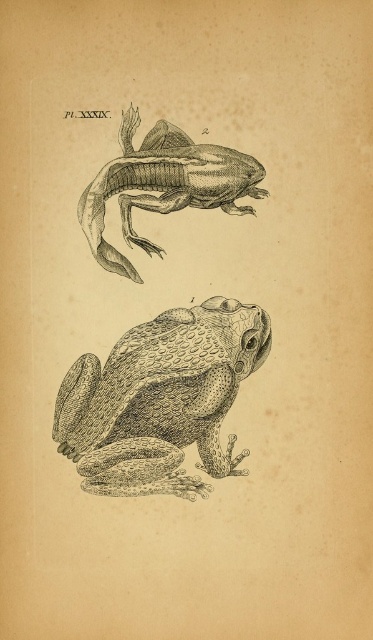
Which of these two, etched paper frog at center or etched paper frog at upper center, stands taller?

With more height is etched paper frog at center.

Is etched paper frog at center shorter than etched paper frog at upper center?

In fact, etched paper frog at center may be taller than etched paper frog at upper center.

Who is more distant from viewer, (155, 433) or (108, 252)?

The point (108, 252) is behind.

At what (x,y) coordinates should I click in order to perform the action: click on etched paper frog at center. Please return your answer as a coordinate pair (x, y). Image resolution: width=373 pixels, height=640 pixels. Looking at the image, I should click on (161, 400).